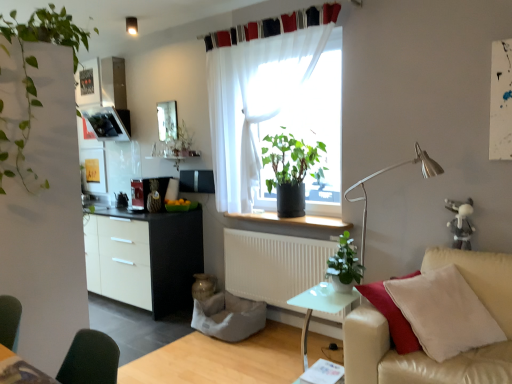
Question: Is green matte plant at center, the 2th houseplant in the left-to-right sequence, positioned with its back to translucent fabric at center, the second window screen positioned from the back?

Choices:
 (A) no
 (B) yes

Answer: (B)

Question: Can you confirm if green matte plant at center, the 3th houseplant positioned from the front, is positioned to the left of translucent fabric at center, arranged as the 1th window screen when viewed from the right?

Choices:
 (A) yes
 (B) no

Answer: (A)

Question: Can you confirm if green matte plant at center, positioned as the 2th houseplant in right-to-left order, is thinner than translucent fabric at center, which appears as the first window screen when viewed from the front?

Choices:
 (A) yes
 (B) no

Answer: (B)

Question: Could you tell me if green matte plant at center, the 2th houseplant in the left-to-right sequence, is facing translucent fabric at center, the second window screen positioned from the back?

Choices:
 (A) yes
 (B) no

Answer: (B)

Question: Is green matte plant at center, which is the first houseplant from back to front, beside translucent fabric at center, which appears as the first window screen when viewed from the front?

Choices:
 (A) yes
 (B) no

Answer: (B)

Question: Is green matte plant at center, the 2th houseplant in the left-to-right sequence, far from translucent fabric at center, placed as the 2th window screen when sorted from left to right?

Choices:
 (A) yes
 (B) no

Answer: (B)

Question: Is white matte cabinet at left to the left of transparent glass window screen at upper center, arranged as the 2th window screen when viewed from the right, from the viewer's perspective?

Choices:
 (A) yes
 (B) no

Answer: (A)

Question: Can you see white matte cabinet at left touching transparent glass window screen at upper center, the 2th window screen in the front-to-back sequence?

Choices:
 (A) yes
 (B) no

Answer: (B)

Question: Is white matte cabinet at left positioned beyond the bounds of transparent glass window screen at upper center, the first window screen in the left-to-right sequence?

Choices:
 (A) yes
 (B) no

Answer: (A)

Question: From a real-world perspective, is white matte cabinet at left beneath transparent glass window screen at upper center, which appears as the 1th window screen when viewed from the back?

Choices:
 (A) yes
 (B) no

Answer: (A)

Question: From the image's perspective, is white matte cabinet at left located above transparent glass window screen at upper center, the first window screen in the left-to-right sequence?

Choices:
 (A) no
 (B) yes

Answer: (A)

Question: Is white matte cabinet at left positioned behind transparent glass window screen at upper center, which appears as the 1th window screen when viewed from the back?

Choices:
 (A) no
 (B) yes

Answer: (A)

Question: Is white matte cabinet at left further to the viewer compared to metallic silver toaster at left?

Choices:
 (A) yes
 (B) no

Answer: (B)